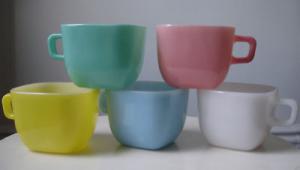
At what (x,y) coordinates should I click in order to perform the action: click on corner of the room. Please return your answer as a coordinate pair (x, y). This screenshot has height=170, width=300. Looking at the image, I should click on (15, 8), (14, 26), (14, 50), (15, 69), (16, 81), (14, 129).